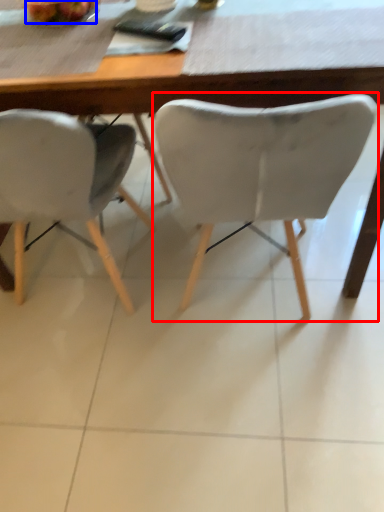
Question: Among these objects, which one is nearest to the camera, chair (highlighted by a red box) or fruit (highlighted by a blue box)?

Choices:
 (A) chair
 (B) fruit

Answer: (A)